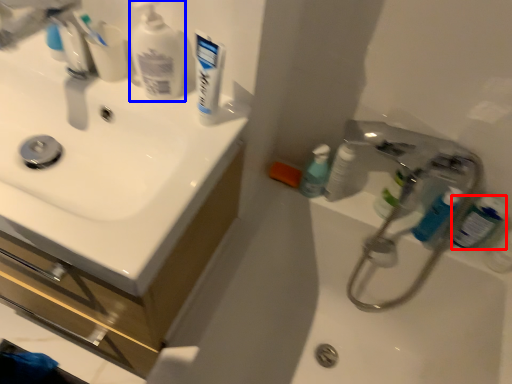
Question: Which object is further to the camera taking this photo, mouthwash (highlighted by a red box) or cleaning product (highlighted by a blue box)?

Choices:
 (A) mouthwash
 (B) cleaning product

Answer: (A)